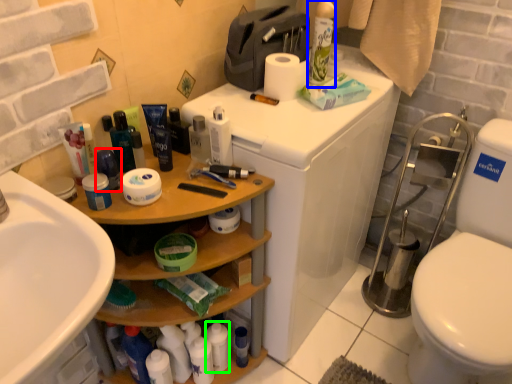
Question: Considering the real-world distances, which object is closest to toiletry (highlighted by a red box)? cleaning product (highlighted by a blue box) or toiletry (highlighted by a green box).

Choices:
 (A) cleaning product
 (B) toiletry

Answer: (B)